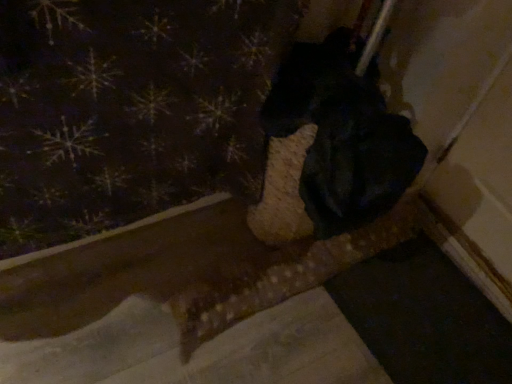
At what (x,y) coordinates should I click in order to perform the action: click on dark fabric with snowflake pattern at upper left. Please return your answer as a coordinate pair (x, y). Looking at the image, I should click on (129, 108).

The image size is (512, 384). Describe the element at coordinates (129, 108) in the screenshot. I see `dark fabric with snowflake pattern at upper left` at that location.

Describe the element at coordinates (333, 144) in the screenshot. The width and height of the screenshot is (512, 384). I see `black matte dog at center` at that location.

Locate an element on the screen. The height and width of the screenshot is (384, 512). black matte dog at center is located at coordinates (333, 144).

In order to face black matte dog at center, should I rotate leftwards or rightwards?

It's best to rotate right around 7.155 degrees.

Where is `dark fabric with snowflake pattern at upper left`? The width and height of the screenshot is (512, 384). dark fabric with snowflake pattern at upper left is located at coordinates (129, 108).

Considering the relative positions of dark fabric with snowflake pattern at upper left and black matte dog at center in the image provided, is dark fabric with snowflake pattern at upper left to the left or to the right of black matte dog at center?

Clearly, dark fabric with snowflake pattern at upper left is on the left of black matte dog at center in the image.

Is the position of dark fabric with snowflake pattern at upper left more distant than that of black matte dog at center?

No, dark fabric with snowflake pattern at upper left is in front of black matte dog at center.

Which point is more distant from viewer, (x=108, y=170) or (x=264, y=198)?

The point (x=264, y=198) is farther from the camera.

From the image's perspective, which one is positioned higher, dark fabric with snowflake pattern at upper left or black matte dog at center?

dark fabric with snowflake pattern at upper left is shown above in the image.

From a real-world perspective, between dark fabric with snowflake pattern at upper left and black matte dog at center, who is vertically lower?

In real-world perspective, black matte dog at center is lower.

Can you confirm if dark fabric with snowflake pattern at upper left is thinner than black matte dog at center?

Yes, dark fabric with snowflake pattern at upper left is thinner than black matte dog at center.

Which of these two, dark fabric with snowflake pattern at upper left or black matte dog at center, stands taller?

dark fabric with snowflake pattern at upper left.

Consider the image. Does dark fabric with snowflake pattern at upper left have a larger size compared to black matte dog at center?

Indeed, dark fabric with snowflake pattern at upper left has a larger size compared to black matte dog at center.

Can we say dark fabric with snowflake pattern at upper left lies outside black matte dog at center?

That's correct, dark fabric with snowflake pattern at upper left is outside of black matte dog at center.

Is dark fabric with snowflake pattern at upper left far away from black matte dog at center?

They are positioned close to each other.

Is dark fabric with snowflake pattern at upper left facing away from black matte dog at center?

dark fabric with snowflake pattern at upper left does not have its back to black matte dog at center.

How many degrees apart are the facing directions of dark fabric with snowflake pattern at upper left and black matte dog at center?

dark fabric with snowflake pattern at upper left and black matte dog at center are facing 3.38 degrees away from each other.

Locate an element on the screen. This screenshot has height=384, width=512. curtain that is on the left side of black matte dog at center is located at coordinates (129, 108).

In the image, is black matte dog at center on the left side or the right side of dark fabric with snowflake pattern at upper left?

Based on their positions, black matte dog at center is located to the right of dark fabric with snowflake pattern at upper left.

Which object is closer to the camera taking this photo, black matte dog at center or dark fabric with snowflake pattern at upper left?

dark fabric with snowflake pattern at upper left is in front.

Is point (413, 169) farther from camera compared to point (50, 200)?

No, it is not.

From the image's perspective, is black matte dog at center above or below dark fabric with snowflake pattern at upper left?

black matte dog at center is below dark fabric with snowflake pattern at upper left.

From a real-world perspective, is black matte dog at center on dark fabric with snowflake pattern at upper left?

No, from a real-world perspective, black matte dog at center is not above dark fabric with snowflake pattern at upper left.

Which object is wider, black matte dog at center or dark fabric with snowflake pattern at upper left?

black matte dog at center.

Is black matte dog at center shorter than dark fabric with snowflake pattern at upper left?

Correct, black matte dog at center is not as tall as dark fabric with snowflake pattern at upper left.

Does black matte dog at center have a smaller size compared to dark fabric with snowflake pattern at upper left?

Yes.

Is black matte dog at center situated inside dark fabric with snowflake pattern at upper left or outside?

black matte dog at center cannot be found inside dark fabric with snowflake pattern at upper left.

Is black matte dog at center in contact with dark fabric with snowflake pattern at upper left?

No, black matte dog at center is not with dark fabric with snowflake pattern at upper left.

Is black matte dog at center turned away from dark fabric with snowflake pattern at upper left?

No, black matte dog at center is not facing the opposite direction of dark fabric with snowflake pattern at upper left.

How different are the orientations of black matte dog at center and dark fabric with snowflake pattern at upper left in degrees?

The angle between the facing direction of black matte dog at center and the facing direction of dark fabric with snowflake pattern at upper left is 3.38 degrees.

Find the location of `animal behind the dark fabric with snowflake pattern at upper left`. animal behind the dark fabric with snowflake pattern at upper left is located at coordinates (333, 144).

Locate an element on the screen. The image size is (512, 384). animal that is below the dark fabric with snowflake pattern at upper left (from the image's perspective) is located at coordinates (333, 144).

Locate an element on the screen. animal behind the dark fabric with snowflake pattern at upper left is located at coordinates (333, 144).